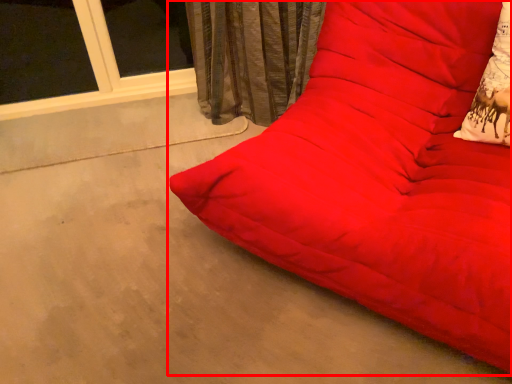
Question: Observing the image, what is the correct spatial positioning of studio couch (annotated by the red box) in reference to throw pillow?

Choices:
 (A) left
 (B) right

Answer: (A)